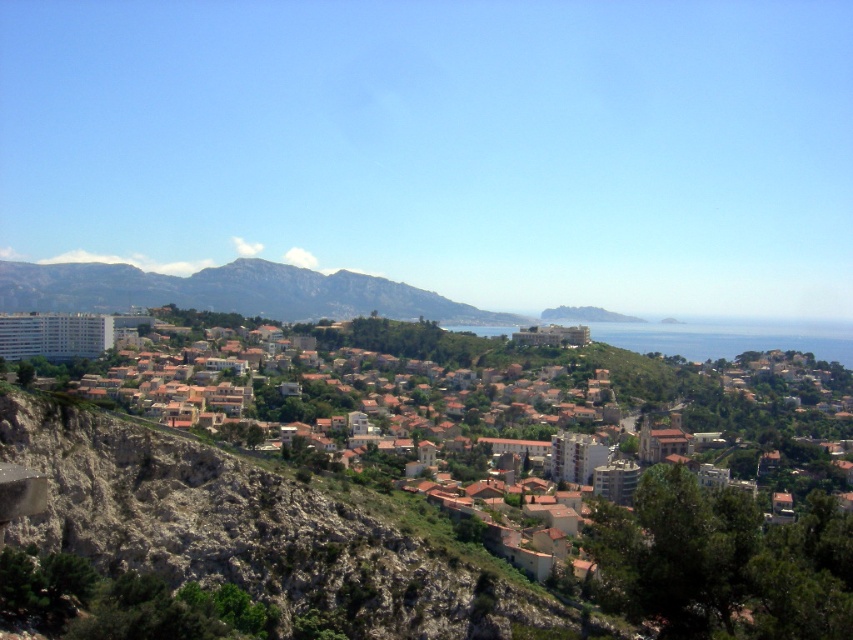
Can you confirm if white concrete buildings at center is smaller than rocky brown mountain at center?

No.

Describe the element at coordinates (186, 509) in the screenshot. Image resolution: width=853 pixels, height=640 pixels. I see `white concrete buildings at center` at that location.

Find the location of a particular element. white concrete buildings at center is located at coordinates (186, 509).

Can you confirm if white concrete buildings at center is wider than blue water at center?

Yes, white concrete buildings at center is wider than blue water at center.

Which is behind, point (114, 381) or point (723, 349)?

Point (723, 349)

Where is `white concrete buildings at center`? The width and height of the screenshot is (853, 640). white concrete buildings at center is located at coordinates (186, 509).

Describe the element at coordinates (230, 292) in the screenshot. Image resolution: width=853 pixels, height=640 pixels. I see `rocky brown mountain at center` at that location.

Is rocky brown mountain at center below blue water at center?

Incorrect, rocky brown mountain at center is not positioned below blue water at center.

Image resolution: width=853 pixels, height=640 pixels. I want to click on rocky brown mountain at center, so click(230, 292).